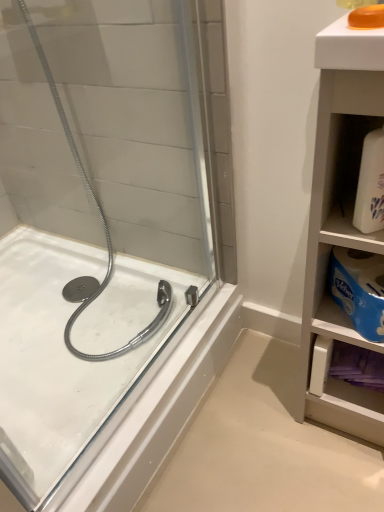
What do you see at coordinates (367, 17) in the screenshot? I see `translucent orange soap at upper right` at bounding box center [367, 17].

Describe the element at coordinates (370, 185) in the screenshot. I see `white matte bottle at right` at that location.

I want to click on translucent orange soap at upper right, so click(367, 17).

Would you consider white matte bottle at right to be distant from translucent orange soap at upper right?

They are positioned close to each other.

Does white matte bottle at right turn towards translucent orange soap at upper right?

No, white matte bottle at right does not turn towards translucent orange soap at upper right.

Considering the sizes of white glossy bath at left and white matte bottle at right in the image, is white glossy bath at left taller or shorter than white matte bottle at right?

Clearly, white glossy bath at left is shorter compared to white matte bottle at right.

In terms of size, does white glossy bath at left appear bigger or smaller than white matte bottle at right?

white glossy bath at left is bigger than white matte bottle at right.

Do you think white glossy bath at left is within white matte bottle at right, or outside of it?

white glossy bath at left is outside white matte bottle at right.

Image resolution: width=384 pixels, height=512 pixels. Identify the location of bath on the left of white matte bottle at right. (74, 358).

From the image's perspective, between white matte cabinet at right and translucent orange soap at upper right, which one is located above?

translucent orange soap at upper right.

Is white matte cabinet at right to the left of translucent orange soap at upper right from the viewer's perspective?

Incorrect, white matte cabinet at right is not on the left side of translucent orange soap at upper right.

Considering the sizes of objects white matte cabinet at right and translucent orange soap at upper right in the image provided, who is bigger, white matte cabinet at right or translucent orange soap at upper right?

white matte cabinet at right is bigger.

I want to click on soap behind the white matte cabinet at right, so click(367, 17).

Locate an element on the screen. The image size is (384, 512). bathroom cabinet lying in front of the white matte bottle at right is located at coordinates (339, 224).

Are white matte bottle at right and white matte cabinet at right located far from each other?

No, there isn't a large distance between white matte bottle at right and white matte cabinet at right.

How different are the orientations of white matte bottle at right and white matte cabinet at right in degrees?

They differ by 2.03 degrees in their facing directions.

Which is in front, point (353, 220) or point (336, 150)?

Positioned in front is point (353, 220).

Considering the relative sizes of translucent orange soap at upper right and white matte cabinet at right in the image provided, is translucent orange soap at upper right taller than white matte cabinet at right?

Incorrect, the height of translucent orange soap at upper right is not larger of that of white matte cabinet at right.

How far apart are translucent orange soap at upper right and white matte cabinet at right?

16.27 inches.

How many degrees apart are the facing directions of translucent orange soap at upper right and white matte cabinet at right?

They differ by 2.32 degrees in their facing directions.

From the image's perspective, is translucent orange soap at upper right located above or below white matte cabinet at right?

Based on their image positions, translucent orange soap at upper right is located above white matte cabinet at right.

Does white glossy bath at left have a smaller size compared to translucent orange soap at upper right?

No.

Is white glossy bath at left inside the boundaries of translucent orange soap at upper right, or outside?

white glossy bath at left is located beyond the bounds of translucent orange soap at upper right.

Is white glossy bath at left facing away from translucent orange soap at upper right?

No.

Considering their positions, is white glossy bath at left located in front of or behind translucent orange soap at upper right?

white glossy bath at left is behind translucent orange soap at upper right.

Is white matte cabinet at right situated inside white glossy bath at left or outside?

white matte cabinet at right is spatially situated outside white glossy bath at left.

Is white matte cabinet at right far from white glossy bath at left?

That's not correct — white matte cabinet at right is a little close to white glossy bath at left.

This screenshot has width=384, height=512. Find the location of `soap above the white matte bottle at right (from a real-world perspective)`. soap above the white matte bottle at right (from a real-world perspective) is located at coordinates (367, 17).

The height and width of the screenshot is (512, 384). Find the location of `bath behind the white matte bottle at right`. bath behind the white matte bottle at right is located at coordinates (74, 358).

From the picture: Which object lies nearer to the anchor point translucent orange soap at upper right, white glossy bath at left or white matte bottle at right?

white matte bottle at right is closer to translucent orange soap at upper right.

Estimate the real-world distances between objects in this image. Which object is further from white matte cabinet at right, translucent orange soap at upper right or white glossy bath at left?

white glossy bath at left is further to white matte cabinet at right.

From the image, which object appears to be farther from white matte cabinet at right, white matte bottle at right or white glossy bath at left?

white glossy bath at left.

Which object lies nearer to the anchor point white glossy bath at left, white matte bottle at right or translucent orange soap at upper right?

Among the two, white matte bottle at right is located nearer to white glossy bath at left.

From the picture: Estimate the real-world distances between objects in this image. Which object is closer to translucent orange soap at upper right, white matte bottle at right or white glossy bath at left?

white matte bottle at right is positioned closer to the anchor translucent orange soap at upper right.

Considering their positions, is white matte cabinet at right positioned closer to white glossy bath at left than white matte bottle at right?

Based on the image, white matte cabinet at right appears to be nearer to white glossy bath at left.

When comparing their distances from white matte bottle at right, does translucent orange soap at upper right or white matte cabinet at right seem closer?

white matte cabinet at right lies closer to white matte bottle at right than the other object.

Based on their spatial positions, is translucent orange soap at upper right or white glossy bath at left closer to white matte bottle at right?

translucent orange soap at upper right.

The height and width of the screenshot is (512, 384). Identify the location of cleaning product situated between white glossy bath at left and white matte cabinet at right from left to right. (370, 185).

At what (x,y) coordinates should I click in order to perform the action: click on cleaning product between translucent orange soap at upper right and white matte cabinet at right in the vertical direction. Please return your answer as a coordinate pair (x, y). Image resolution: width=384 pixels, height=512 pixels. Looking at the image, I should click on (370, 185).

Where is `soap located between white glossy bath at left and white matte bottle at right in the left-right direction`? soap located between white glossy bath at left and white matte bottle at right in the left-right direction is located at coordinates (367, 17).

At what (x,y) coordinates should I click in order to perform the action: click on soap between white glossy bath at left and white matte cabinet at right from left to right. Please return your answer as a coordinate pair (x, y). The image size is (384, 512). Looking at the image, I should click on (367, 17).